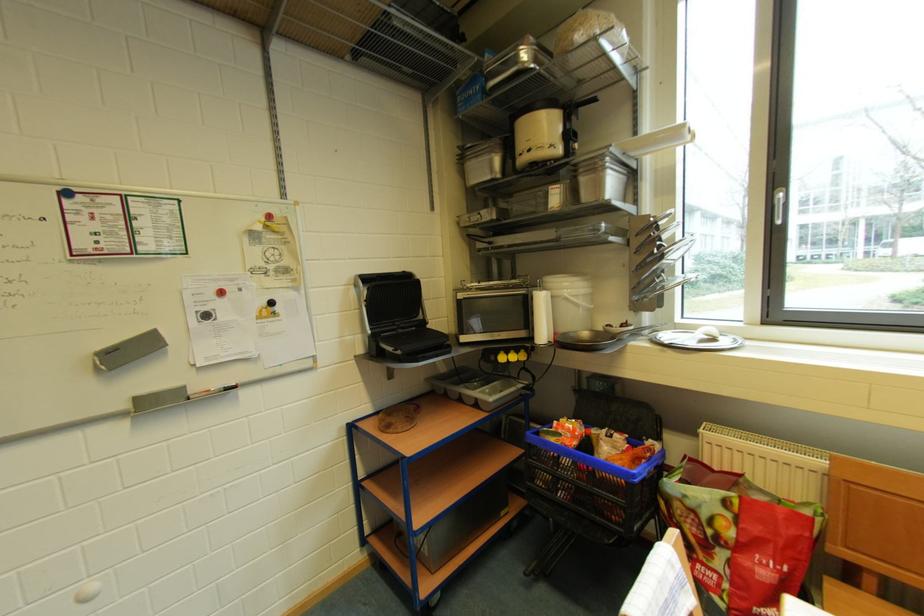
Identify the location of metal can. This screenshot has height=616, width=924. (602, 177).